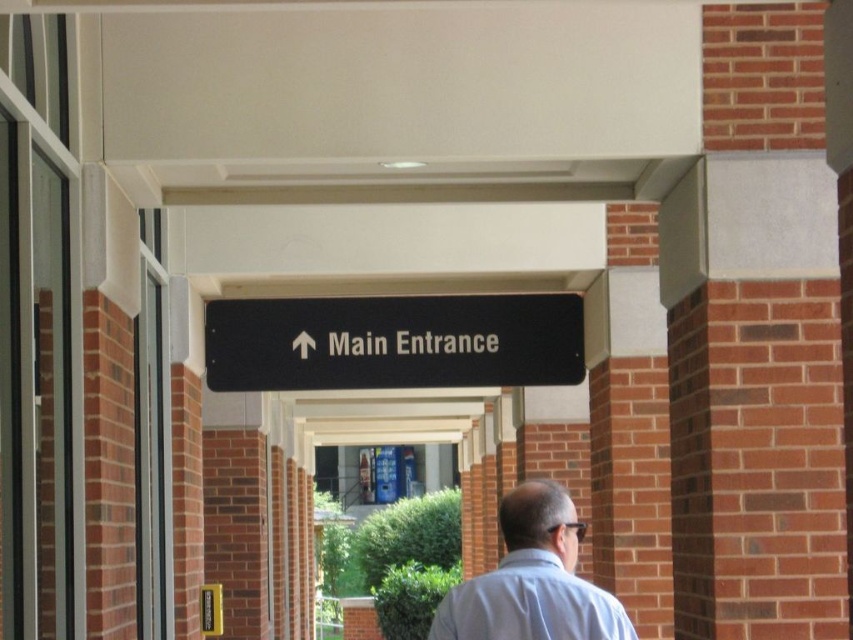
Question: Which of the following is the closest to the observer?

Choices:
 (A) click(207, 324)
 (B) click(589, 596)

Answer: (B)

Question: Does black plastic sign at center appear on the left side of light blue shirt at center?

Choices:
 (A) no
 (B) yes

Answer: (B)

Question: Does black plastic sign at center appear on the left side of light blue shirt at center?

Choices:
 (A) yes
 (B) no

Answer: (A)

Question: Which point appears farthest from the camera in this image?

Choices:
 (A) (508, 582)
 (B) (459, 376)

Answer: (B)

Question: In this image, where is black plastic sign at center located relative to light blue shirt at center?

Choices:
 (A) above
 (B) below

Answer: (A)

Question: Among these points, which one is nearest to the camera?

Choices:
 (A) (514, 522)
 (B) (523, 371)

Answer: (A)